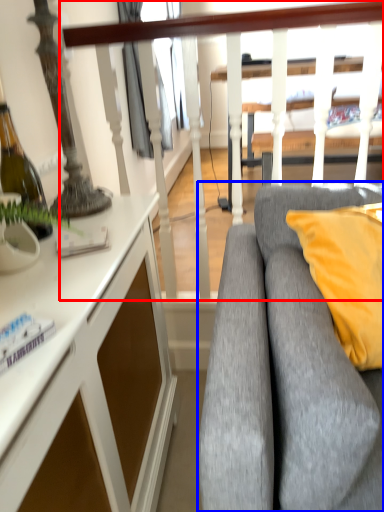
Question: Which object appears farthest to the camera in this image, rail (highlighted by a red box) or studio couch (highlighted by a blue box)?

Choices:
 (A) rail
 (B) studio couch

Answer: (A)